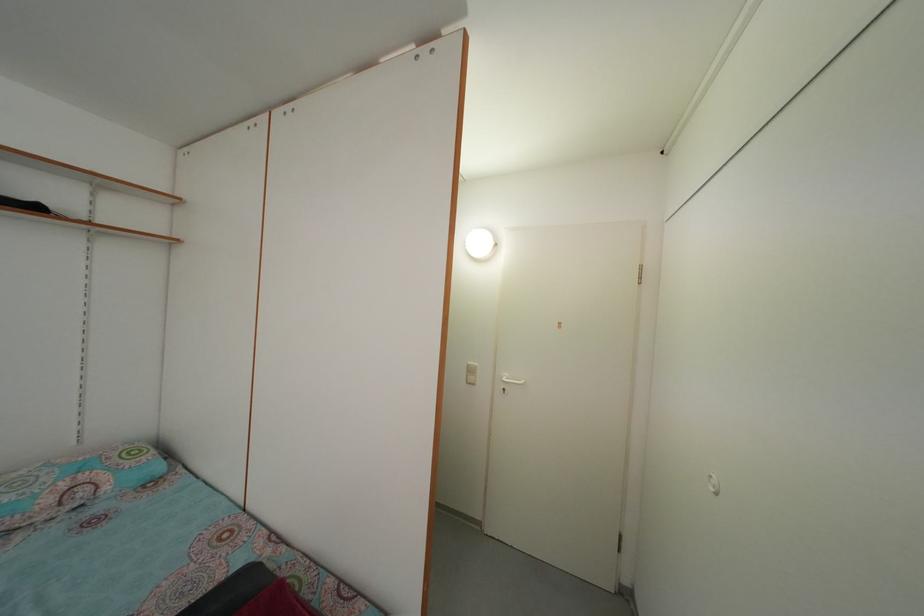
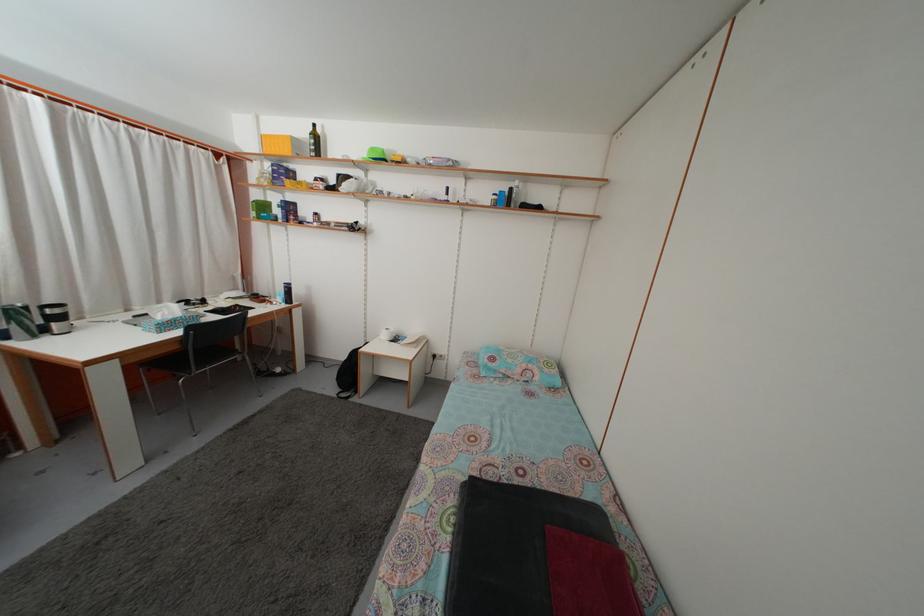
Question: The first image is from the beginning of the video and the second image is from the end. How did the camera likely rotate when shooting the video?

Choices:
 (A) Left
 (B) Right
 (C) Up
 (D) Down

Answer: (A)